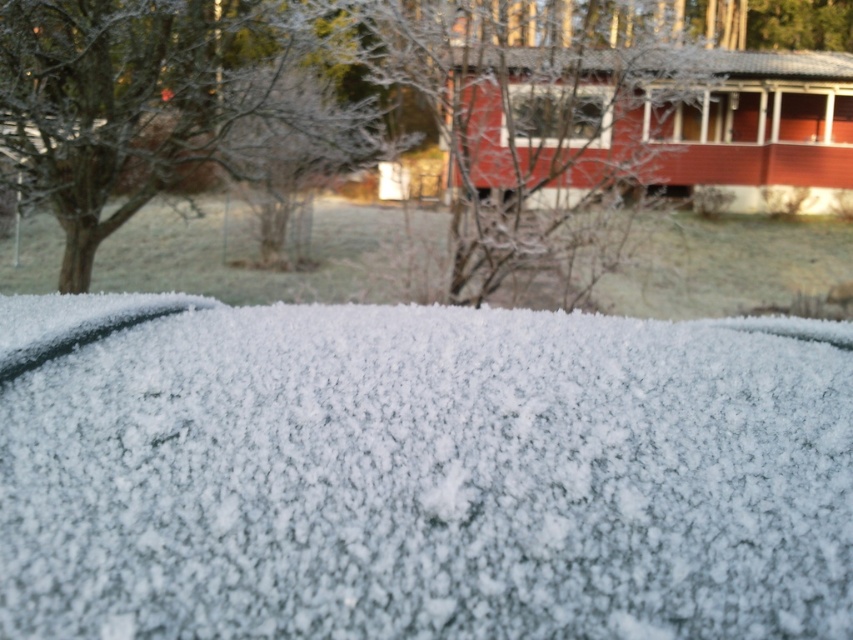
Question: From the image, what is the correct spatial relationship of white crystalline frost at center in relation to transparent glass window at center?

Choices:
 (A) left
 (B) right

Answer: (A)

Question: Does white crystalline frost at center appear on the right side of transparent glass window at center?

Choices:
 (A) no
 (B) yes

Answer: (A)

Question: Which point is farther to the camera?

Choices:
 (A) (581, 112)
 (B) (808, 476)

Answer: (A)

Question: Which object is closer to the camera taking this photo?

Choices:
 (A) transparent glass window at center
 (B) white crystalline frost at center

Answer: (B)

Question: Which of the following is the closest to the observer?

Choices:
 (A) white crystalline frost at center
 (B) transparent glass window at center

Answer: (A)

Question: Can you confirm if white crystalline frost at center is positioned above transparent glass window at center?

Choices:
 (A) yes
 (B) no

Answer: (B)